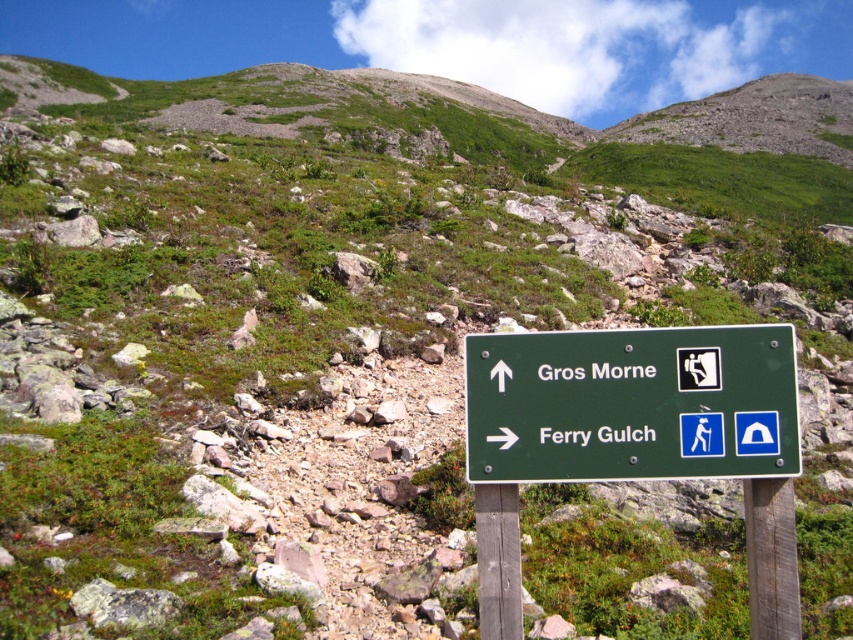
Question: Which point is farther from the camera taking this photo?

Choices:
 (A) (780, 508)
 (B) (492, 636)
 (C) (699, 474)

Answer: (C)

Question: Is green wooden signpost at center below brown wooden pole at center?

Choices:
 (A) yes
 (B) no

Answer: (B)

Question: Is brown wooden pole at center above brown wooden post at center?

Choices:
 (A) no
 (B) yes

Answer: (B)

Question: Which point is farther to the camera?

Choices:
 (A) (758, 532)
 (B) (489, 484)
 (C) (511, 470)

Answer: (B)

Question: Is green wooden signpost at center above green plastic sign at center?

Choices:
 (A) no
 (B) yes

Answer: (A)

Question: Which of the following is the closest to the observer?

Choices:
 (A) (502, 522)
 (B) (793, 536)
 (C) (791, 522)
 (D) (753, 454)

Answer: (D)